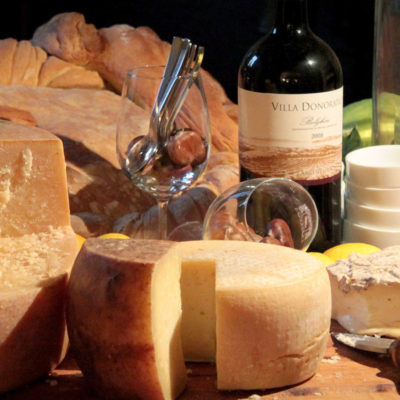
Locate an element on the screen. The height and width of the screenshot is (400, 400). surface is located at coordinates (357, 385).